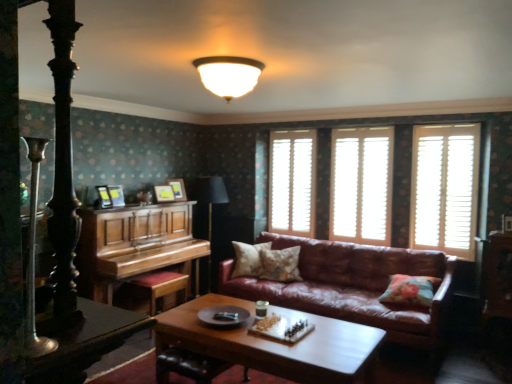
Question: Which direction should I rotate to look at white wooden shutters at center, positioned as the second window in left-to-right order, — up or down?

Choices:
 (A) down
 (B) up

Answer: (B)

Question: Does wooden chessboard at center have a lesser height compared to floral fabric cushion at right, which ranks as the third pillow in back-to-front order?

Choices:
 (A) yes
 (B) no

Answer: (B)

Question: Considering the relative positions of wooden chessboard at center and floral fabric cushion at right, which ranks as the third pillow in back-to-front order, in the image provided, is wooden chessboard at center in front of floral fabric cushion at right, which ranks as the third pillow in back-to-front order,?

Choices:
 (A) no
 (B) yes

Answer: (B)

Question: Does wooden chessboard at center touch floral fabric cushion at right, which ranks as the third pillow in back-to-front order?

Choices:
 (A) no
 (B) yes

Answer: (A)

Question: Is wooden chessboard at center not near floral fabric cushion at right, which ranks as the third pillow in back-to-front order?

Choices:
 (A) yes
 (B) no

Answer: (A)

Question: From a real-world perspective, does wooden chessboard at center sit lower than floral fabric cushion at right, which is the 1th pillow from front to back?

Choices:
 (A) yes
 (B) no

Answer: (A)

Question: Is wooden chessboard at center turned away from floral fabric cushion at right, which is the 3th pillow in left-to-right order?

Choices:
 (A) no
 (B) yes

Answer: (B)

Question: Is leather couch at center placed right next to fluffy beige pillow at center, the second pillow when ordered from back to front?

Choices:
 (A) yes
 (B) no

Answer: (B)

Question: Is leather couch at center to the left of fluffy beige pillow at center, the second pillow positioned from the left, from the viewer's perspective?

Choices:
 (A) yes
 (B) no

Answer: (B)

Question: Is leather couch at center facing towards fluffy beige pillow at center, the second pillow when ordered from back to front?

Choices:
 (A) no
 (B) yes

Answer: (B)

Question: Does leather couch at center lie in front of fluffy beige pillow at center, the second pillow positioned from the left?

Choices:
 (A) yes
 (B) no

Answer: (A)

Question: Can you confirm if leather couch at center is smaller than fluffy beige pillow at center, the second pillow positioned from the left?

Choices:
 (A) yes
 (B) no

Answer: (B)

Question: Considering the relative sizes of leather couch at center and fluffy beige pillow at center, which ranks as the 2th pillow in right-to-left order, in the image provided, is leather couch at center taller than fluffy beige pillow at center, which ranks as the 2th pillow in right-to-left order,?

Choices:
 (A) no
 (B) yes

Answer: (B)

Question: Considering the relative sizes of leather at center and wooden picture frame at upper center, arranged as the second picture frame when viewed from the left, in the image provided, is leather at center wider than wooden picture frame at upper center, arranged as the second picture frame when viewed from the left,?

Choices:
 (A) no
 (B) yes

Answer: (B)